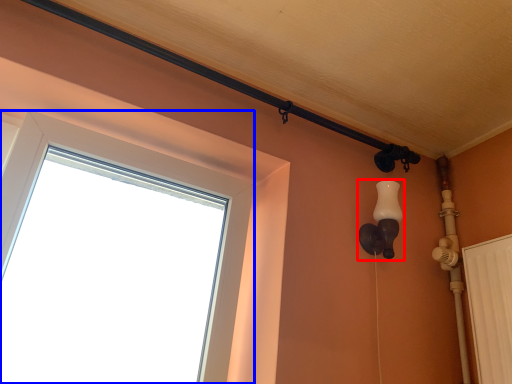
Question: Which object appears closest to the camera in this image, light fixture (highlighted by a red box) or window (highlighted by a blue box)?

Choices:
 (A) light fixture
 (B) window

Answer: (B)